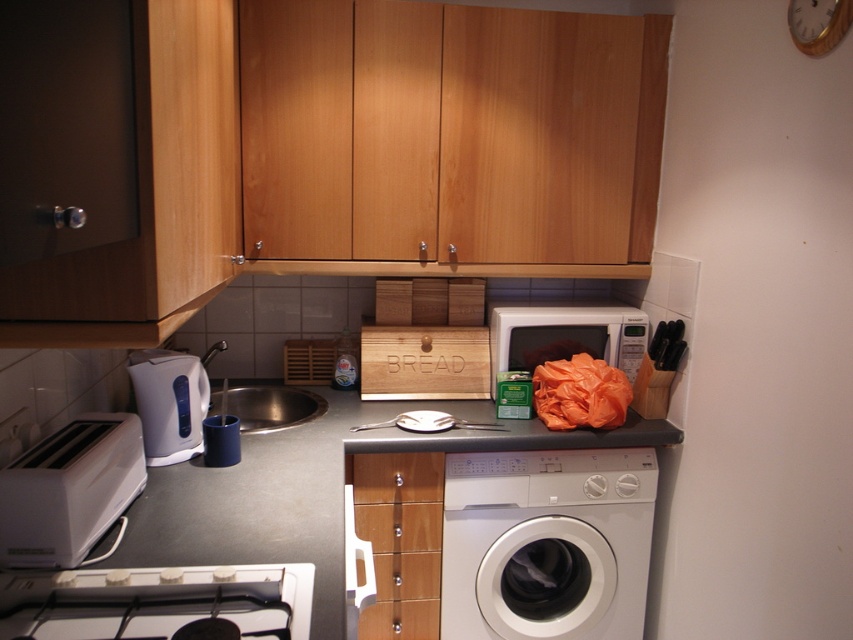
Is smooth gray countertop at center to the left of wooden clock at upper right from the viewer's perspective?

Correct, you'll find smooth gray countertop at center to the left of wooden clock at upper right.

Is smooth gray countertop at center smaller than wooden clock at upper right?

No.

You are a GUI agent. You are given a task and a screenshot of the screen. Output one action in this format:
    pyautogui.click(x=<x>, y=<y>)
    Task: Click on the smooth gray countertop at center
    The image size is (853, 640).
    Given the screenshot: What is the action you would take?
    pyautogui.click(x=311, y=492)

Can you confirm if white matte microwave at center is positioned below white plastic kettle at left?

Incorrect, white matte microwave at center is not positioned below white plastic kettle at left.

How distant is white matte microwave at center from white plastic kettle at left?

A distance of 38.24 inches exists between white matte microwave at center and white plastic kettle at left.

Who is more forward, (576, 312) or (192, 358)?

Point (192, 358)

I want to click on white matte microwave at center, so click(x=566, y=332).

Who is shorter, white plastic kettle at left or stainless steel sink at center?

Standing shorter between the two is stainless steel sink at center.

Does white plastic kettle at left appear on the left side of stainless steel sink at center?

Correct, you'll find white plastic kettle at left to the left of stainless steel sink at center.

I want to click on white plastic kettle at left, so click(169, 403).